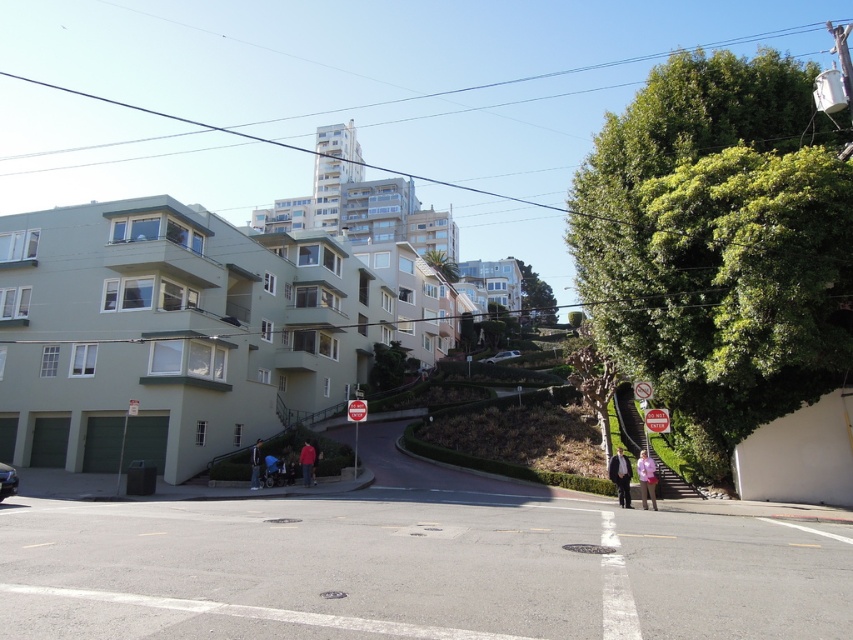
Question: Is metallic rectangular sign at center thinner than blue denim jacket at lower center?

Choices:
 (A) yes
 (B) no

Answer: (B)

Question: Which object is the closest to the dark gray suit at lower right?

Choices:
 (A) red plastic sign at center
 (B) white matte car at center
 (C) pink fabric at lower right
 (D) metallic rectangular sign at center

Answer: (C)

Question: Considering the relative positions of blue denim jacket at lower center and red plastic sign at upper center in the image provided, where is blue denim jacket at lower center located with respect to red plastic sign at upper center?

Choices:
 (A) below
 (B) above

Answer: (A)

Question: Considering the relative positions of metallic rectangular sign at center and white matte car at center in the image provided, where is metallic rectangular sign at center located with respect to white matte car at center?

Choices:
 (A) right
 (B) left

Answer: (A)

Question: Which point is farther to the camera?

Choices:
 (A) (497, 356)
 (B) (7, 476)
 (C) (630, 492)

Answer: (A)

Question: Which is nearer to the dark gray suit at lower right?

Choices:
 (A) metallic silver sedan at lower left
 (B) red plastic sign at upper center

Answer: (B)